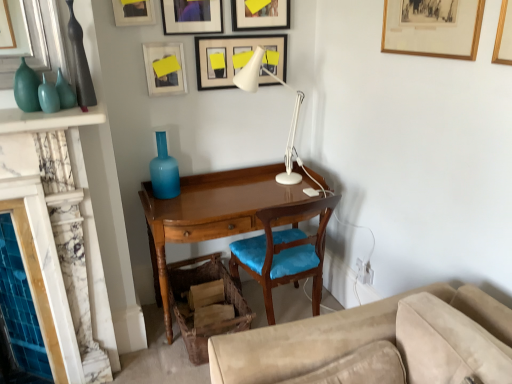
You are a GUI agent. You are given a task and a screenshot of the screen. Output one action in this format:
    pyautogui.click(x=<x>, y=<y>)
    Task: Click on the vacant space in front of matte blue glass vase at center, arranged as the first glass vase when viewed from the right
    The height and width of the screenshot is (384, 512).
    Given the screenshot: What is the action you would take?
    pyautogui.click(x=169, y=204)